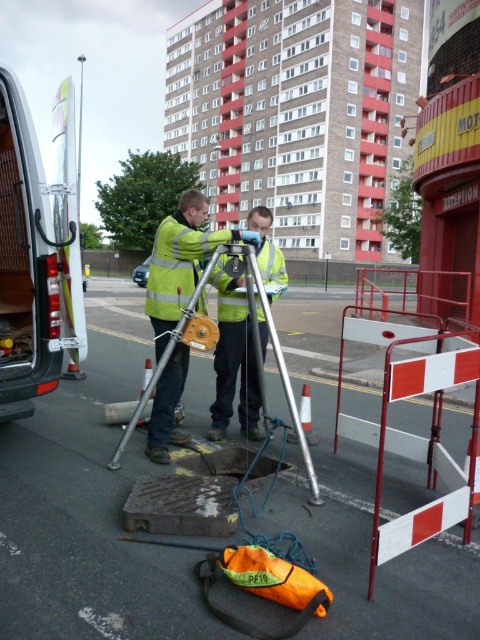
You are a pedestrian walking on the street and see both the yellow reflective vest at center and the reflective yellow safety vest at center. Which one is closer to you?

The yellow reflective vest at center is closer to you since it is in front of the reflective yellow safety vest at center.

You are a pedestrian walking on the street and see the reflective yellow safety vest at center and the silver metallic tripod at center. Which object is taller?

The reflective yellow safety vest at center is taller than the silver metallic tripod at center.